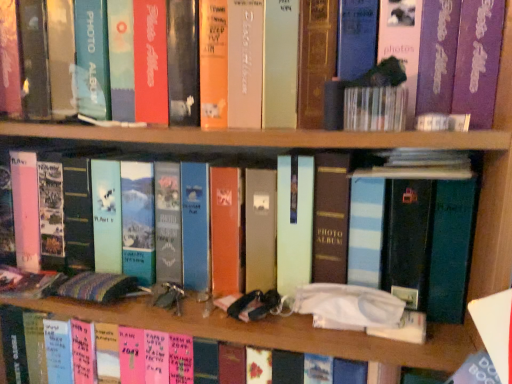
The image size is (512, 384). What are the coordinates of `blank space situated above blue striped photo album at center, the 2th book from the bottom (from a real-world perspective)` in the screenshot? It's located at click(x=175, y=149).